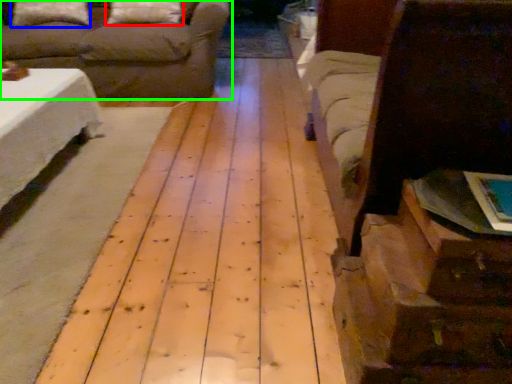
Question: Estimate the real-world distances between objects in this image. Which object is farther from pillow (highlighted by a red box), pillow (highlighted by a blue box) or studio couch (highlighted by a green box)?

Choices:
 (A) pillow
 (B) studio couch

Answer: (A)